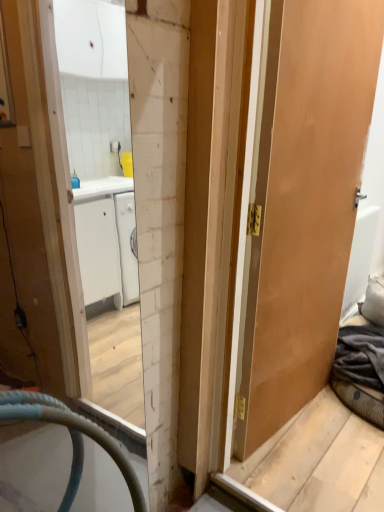
The width and height of the screenshot is (384, 512). What do you see at coordinates (359, 261) in the screenshot?
I see `white textured radiator at right` at bounding box center [359, 261].

What are the coordinates of `white textured radiator at right` in the screenshot? It's located at (359, 261).

What do you see at coordinates (305, 202) in the screenshot? I see `matte wooden door at right` at bounding box center [305, 202].

Image resolution: width=384 pixels, height=512 pixels. What are the coordinates of `matte wooden door at right` in the screenshot? It's located at (305, 202).

The width and height of the screenshot is (384, 512). Find the location of `white textured radiator at right`. white textured radiator at right is located at coordinates (359, 261).

Considering the relative positions of matte wooden door at right and white textured radiator at right in the image provided, is matte wooden door at right to the left or to the right of white textured radiator at right?

From the image, it's evident that matte wooden door at right is to the left of white textured radiator at right.

Does matte wooden door at right lie behind white textured radiator at right?

No, matte wooden door at right is in front of white textured radiator at right.

Is point (317, 166) closer or farther from the camera than point (352, 285)?

Point (317, 166) is closer to the camera than point (352, 285).

From the image's perspective, would you say matte wooden door at right is shown under white textured radiator at right?

No.

From a real-world perspective, between matte wooden door at right and white textured radiator at right, who is vertically lower?

white textured radiator at right is physically lower.

Which of these two, matte wooden door at right or white textured radiator at right, is thinner?

matte wooden door at right is thinner.

Can you confirm if matte wooden door at right is shorter than white textured radiator at right?

In fact, matte wooden door at right may be taller than white textured radiator at right.

Based on their sizes in the image, would you say matte wooden door at right is bigger or smaller than white textured radiator at right?

matte wooden door at right is bigger than white textured radiator at right.

Is matte wooden door at right inside or outside of white textured radiator at right?

matte wooden door at right lies outside white textured radiator at right.

Would you say matte wooden door at right is a long distance from white textured radiator at right?

No, matte wooden door at right is not far from white textured radiator at right.

Is matte wooden door at right looking in the opposite direction of white textured radiator at right?

matte wooden door at right does not have its back to white textured radiator at right.

What's the angular difference between matte wooden door at right and white textured radiator at right's facing directions?

There is a 9.52-degree angle between the facing directions of matte wooden door at right and white textured radiator at right.

How distant is matte wooden door at right from white textured radiator at right?

A distance of 29.76 inches exists between matte wooden door at right and white textured radiator at right.

Identify the location of radiator below the matte wooden door at right (from the image's perspective). Image resolution: width=384 pixels, height=512 pixels. (359, 261).

Considering the positions of objects white textured radiator at right and matte wooden door at right in the image provided, who is more to the right, white textured radiator at right or matte wooden door at right?

Positioned to the right is white textured radiator at right.

Does white textured radiator at right lie behind matte wooden door at right?

Yes, white textured radiator at right is further from the camera.

Which is in front, point (364, 283) or point (280, 294)?

The point (280, 294) is in front.

From the image's perspective, is white textured radiator at right above or below matte wooden door at right?

From the image's perspective, white textured radiator at right appears below matte wooden door at right.

From a real-world perspective, is white textured radiator at right located higher than matte wooden door at right?

Actually, white textured radiator at right is physically below matte wooden door at right in the real world.

Is white textured radiator at right wider or thinner than matte wooden door at right?

Considering their sizes, white textured radiator at right looks broader than matte wooden door at right.

Can you confirm if white textured radiator at right is taller than matte wooden door at right?

No, white textured radiator at right is not taller than matte wooden door at right.

Between white textured radiator at right and matte wooden door at right, which one has smaller size?

white textured radiator at right.

Is matte wooden door at right a part of white textured radiator at right?

That's incorrect, matte wooden door at right is not inside white textured radiator at right.

Are white textured radiator at right and matte wooden door at right located far from each other?

white textured radiator at right is near matte wooden door at right, not far away.

Is white textured radiator at right facing away from matte wooden door at right?

white textured radiator at right is not turned away from matte wooden door at right.

Can you tell me how much white textured radiator at right and matte wooden door at right differ in facing direction?

9.52 degrees.

The height and width of the screenshot is (512, 384). I want to click on radiator located on the right of matte wooden door at right, so click(359, 261).

Locate an element on the screen. Image resolution: width=384 pixels, height=512 pixels. radiator behind the matte wooden door at right is located at coordinates (359, 261).

I want to click on radiator below the matte wooden door at right (from the image's perspective), so click(359, 261).